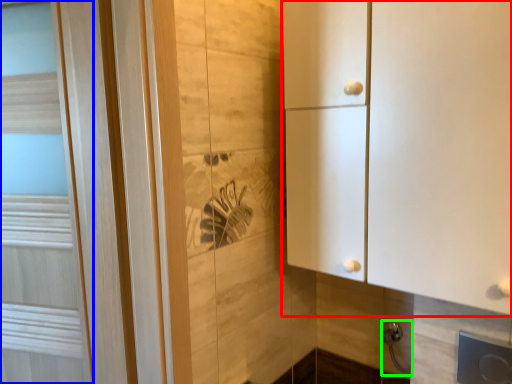
Question: Based on their relative distances, which object is farther from cupboard (highlighted by a red box)? Choose from door (highlighted by a blue box) and door handle (highlighted by a green box).

Choices:
 (A) door
 (B) door handle

Answer: (A)